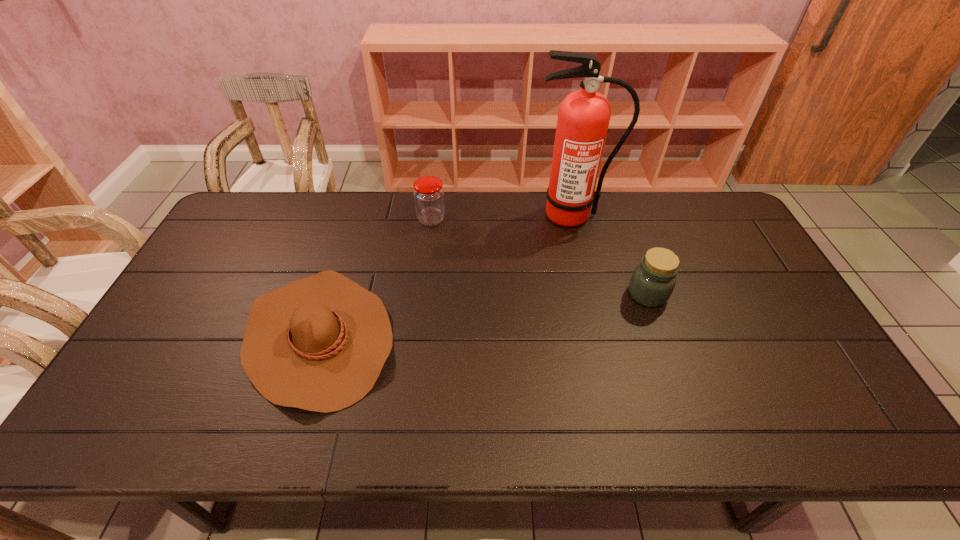
The image size is (960, 540). In order to click on the tallest object in this screenshot , I will do `click(583, 118)`.

The height and width of the screenshot is (540, 960). In order to click on the farther jar in this screenshot , I will do `click(429, 199)`.

Where is `the second object from left to right`? The height and width of the screenshot is (540, 960). the second object from left to right is located at coordinates (429, 199).

Identify the location of the nearer jar. The image size is (960, 540). (652, 283).

This screenshot has width=960, height=540. Identify the location of the leftmost object. (319, 344).

Find the location of a particular element. cowboy hat is located at coordinates (319, 344).

You are a GUI agent. You are given a task and a screenshot of the screen. Output one action in this format:
    pyautogui.click(x=<x>, y=<y>)
    Task: Click on the vacant space located on the handle side of the fire extinguisher
    This screenshot has height=540, width=960.
    Given the screenshot: What is the action you would take?
    pyautogui.click(x=585, y=271)

This screenshot has width=960, height=540. Find the location of `vacant area located on the left of the third object from right to left`. vacant area located on the left of the third object from right to left is located at coordinates (402, 219).

Where is `vacant position located 0.330m on the back of the right jar`? vacant position located 0.330m on the back of the right jar is located at coordinates (618, 212).

Locate an element on the screen. This screenshot has height=540, width=960. vacant space situated 0.140m on the left of the cowboy hat is located at coordinates (190, 337).